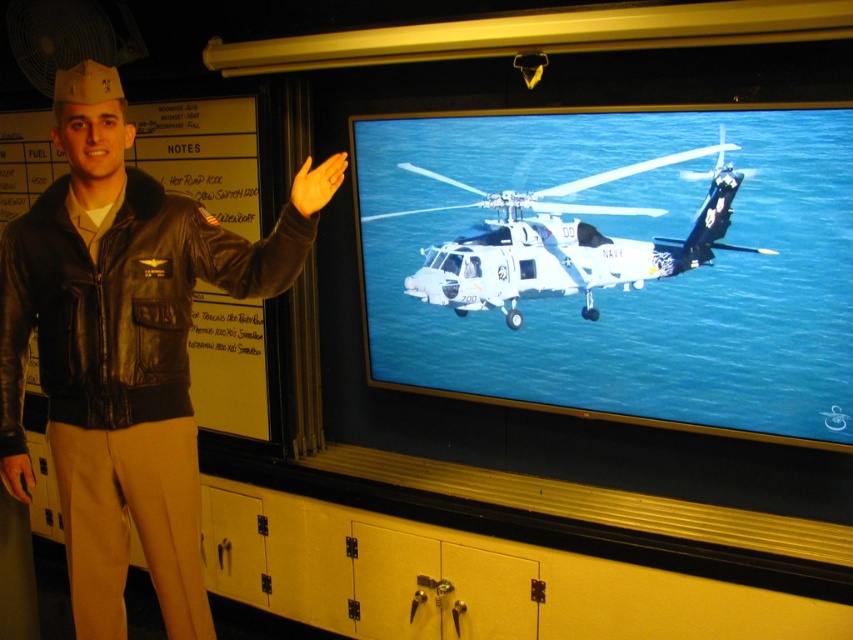
You are a photographer positioned at the center of the room. You want to take a photo of both the black leather jacket at left and the metallic gray helicopter at center. Can you fit both objects into your camera frame if your camera has a 50 inch field of view?

The black leather jacket at left is 36.40 inches away from the metallic gray helicopter at center. Since the distance between them is less than the 50 inch field of view, both objects can be captured in the same frame.